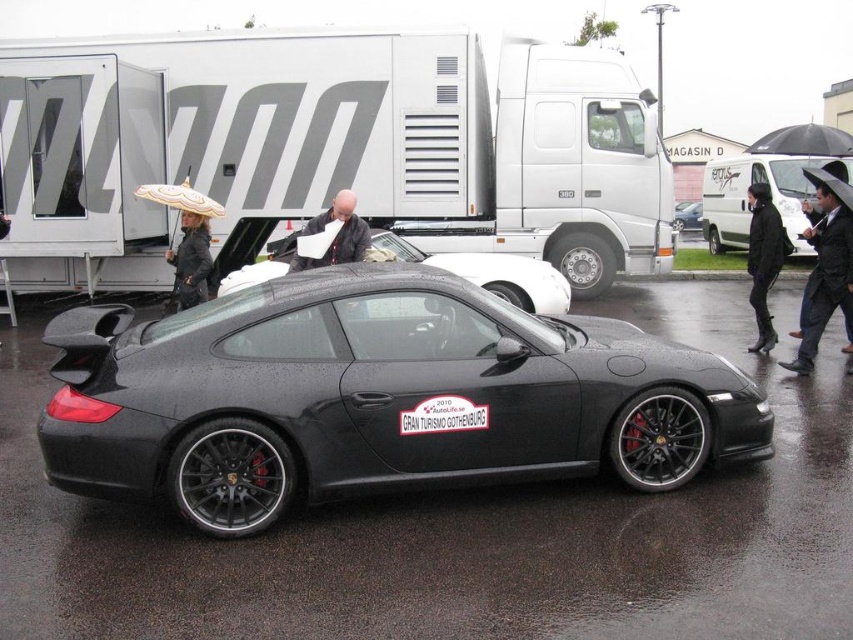
Is point (813, 248) farther from viewer compared to point (811, 276)?

Yes, point (813, 248) is behind point (811, 276).

Who is more distant from viewer, (830,177) or (810,305)?

Point (810,305)

At what (x,y) coordinates should I click in order to perform the action: click on dark suit at center. Please return your answer as a coordinate pair (x, y). Looking at the image, I should click on pyautogui.click(x=827, y=266).

Who is higher up, white matte truck at center or black matte umbrella at upper right?

Positioned higher is black matte umbrella at upper right.

Where is `white matte truck at center`? The width and height of the screenshot is (853, 640). white matte truck at center is located at coordinates (328, 148).

Identify the location of white matte truck at center. The width and height of the screenshot is (853, 640). (328, 148).

Is point (341, 225) closer to viewer compared to point (699, 209)?

Yes, it is in front of point (699, 209).

Consider the image. Can you confirm if matte black jacket at center is taller than shiny black car at center?

Incorrect, matte black jacket at center's height is not larger of shiny black car at center's.

Does point (337, 209) come farther from viewer compared to point (698, 227)?

No, it is in front of (698, 227).

You are a GUI agent. You are given a task and a screenshot of the screen. Output one action in this format:
    pyautogui.click(x=<x>, y=<y>)
    Task: Click on the matte black jacket at center
    
    Given the screenshot: What is the action you would take?
    pyautogui.click(x=337, y=234)